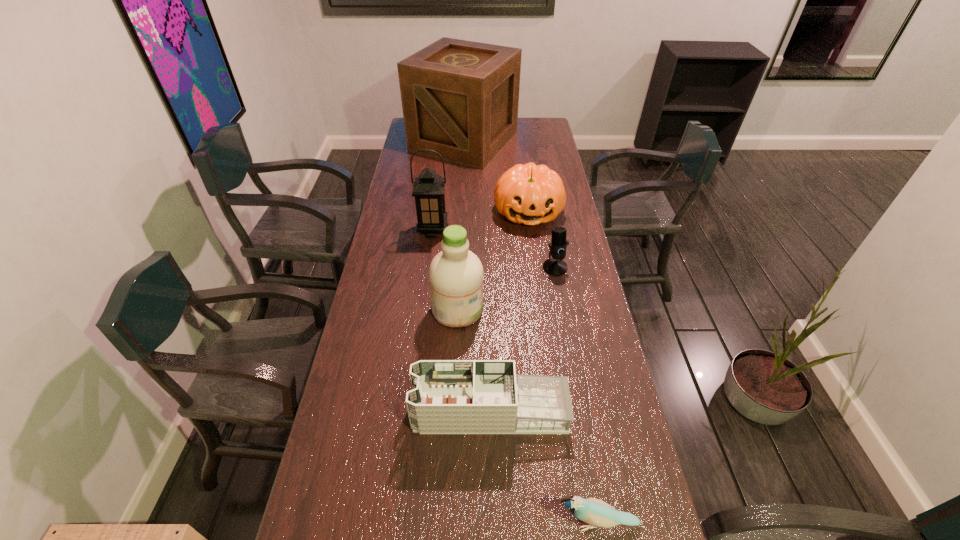
Locate an element on the screen. vacant region between the sixth farthest object and the pumpkin is located at coordinates (510, 312).

Where is `unoccupied position between the lantern and the fourth farthest object`? unoccupied position between the lantern and the fourth farthest object is located at coordinates (494, 249).

Locate an element on the screen. The height and width of the screenshot is (540, 960). unoccupied position between the pumpkin and the tallest object is located at coordinates (496, 177).

Find the location of a particular element. The width and height of the screenshot is (960, 540). object that is the fifth closest to the nearest object is located at coordinates (428, 190).

You are a GUI agent. You are given a task and a screenshot of the screen. Output one action in this format:
    pyautogui.click(x=<x>, y=<y>)
    Task: Click on the object that ranks as the second closest to the tallest object
    This screenshot has width=960, height=540.
    Given the screenshot: What is the action you would take?
    pyautogui.click(x=428, y=190)

Identify the location of vacant area in the image that satisfies the following two spatial constraints: 1. on the carved face of the fourth shortest object; 2. on the front label of the fifth farthest object. This screenshot has width=960, height=540. (541, 309).

Identify the location of vacant position in the image that satisfies the following two spatial constraints: 1. on the carved face of the fourth tallest object; 2. at the entrance of the dollhouse. (555, 411).